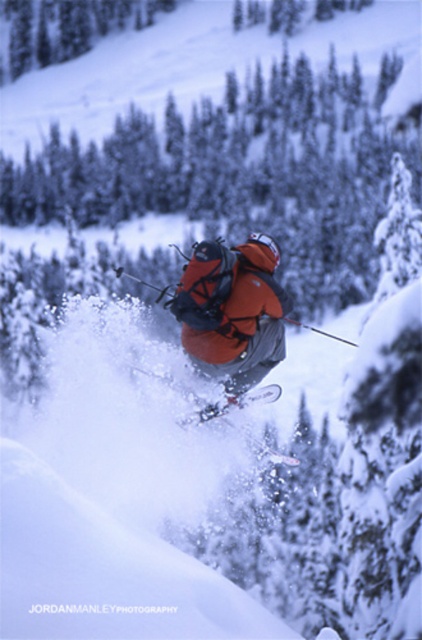
You are a photographer aiming to capture the skier at point point [262,307]. If you want to get a closer shot without moving the camera, what adjustment should you make to your lens?

Since the point [262,307] is 38.70 feet away from the camera, you should zoom in to get a closer shot without moving the camera.

You are a photographer trying to capture the skier in the image. You want to ensure the orange softshell jacket at center and the white metallic ski at center are both clearly visible in your shot. Based on their positions, which object should you focus on first to ensure both are in frame?

The orange softshell jacket at center is positioned on the left side of the white metallic ski at center, so focusing on the orange softshell jacket at center first will help ensure both are in frame as the ski is to the right of the jacket.